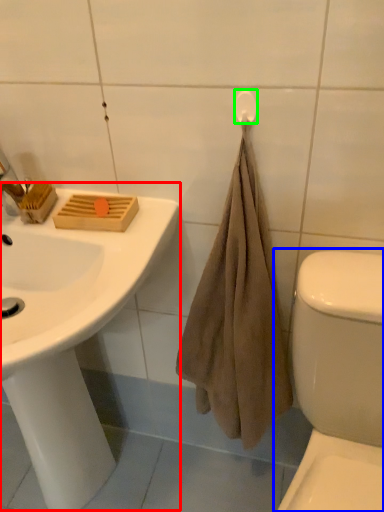
Question: Considering the real-world distances, which object is closest to sink (highlighted by a red box)? toilet (highlighted by a blue box) or towel bar (highlighted by a green box).

Choices:
 (A) toilet
 (B) towel bar

Answer: (A)